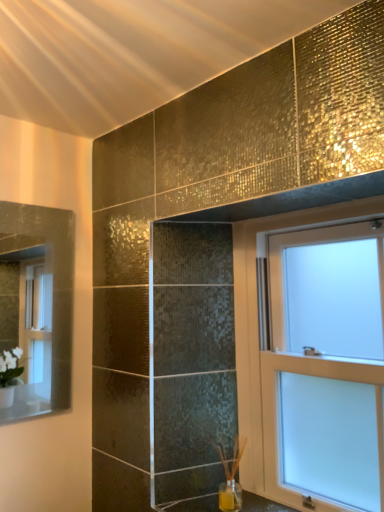
Question: Should I look upward or downward to see white frosted glass window at upper right?

Choices:
 (A) down
 (B) up

Answer: (A)

Question: Is clear glass mirror at left inside white frosted glass window at upper right?

Choices:
 (A) no
 (B) yes

Answer: (A)

Question: Is white frosted glass window at upper right to the right of clear glass mirror at left from the viewer's perspective?

Choices:
 (A) yes
 (B) no

Answer: (A)

Question: From a real-world perspective, is white frosted glass window at upper right physically above clear glass mirror at left?

Choices:
 (A) no
 (B) yes

Answer: (A)

Question: Considering the relative sizes of white frosted glass window at upper right and clear glass mirror at left in the image provided, is white frosted glass window at upper right smaller than clear glass mirror at left?

Choices:
 (A) no
 (B) yes

Answer: (A)

Question: Considering the relative sizes of white frosted glass window at upper right and clear glass mirror at left in the image provided, is white frosted glass window at upper right bigger than clear glass mirror at left?

Choices:
 (A) yes
 (B) no

Answer: (A)

Question: From a real-world perspective, does white frosted glass window at upper right sit lower than clear glass mirror at left?

Choices:
 (A) yes
 (B) no

Answer: (A)

Question: Is white frosted glass window at upper right completely or partially inside clear glass mirror at left?

Choices:
 (A) no
 (B) yes

Answer: (A)

Question: Are clear glass mirror at left and white frosted glass window at upper right far apart?

Choices:
 (A) yes
 (B) no

Answer: (A)

Question: Considering the relative sizes of clear glass mirror at left and white frosted glass window at upper right in the image provided, is clear glass mirror at left shorter than white frosted glass window at upper right?

Choices:
 (A) yes
 (B) no

Answer: (A)

Question: Is clear glass mirror at left facing away from white frosted glass window at upper right?

Choices:
 (A) yes
 (B) no

Answer: (B)

Question: Is clear glass mirror at left positioned behind white frosted glass window at upper right?

Choices:
 (A) yes
 (B) no

Answer: (A)

Question: From a real-world perspective, is clear glass mirror at left positioned under white frosted glass window at upper right based on gravity?

Choices:
 (A) yes
 (B) no

Answer: (B)

Question: In the image, is clear glass mirror at left positioned in front of or behind white frosted glass window at upper right?

Choices:
 (A) front
 (B) behind

Answer: (B)